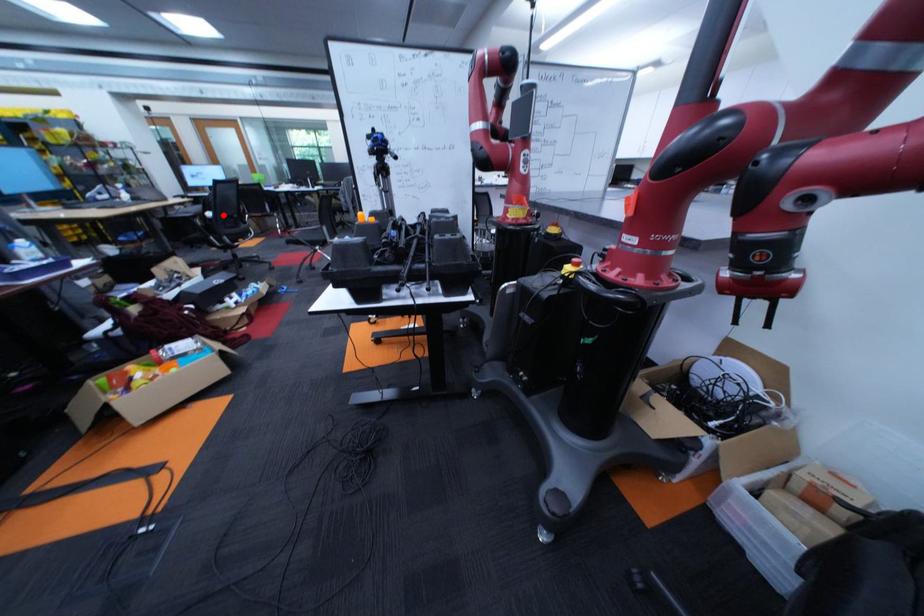
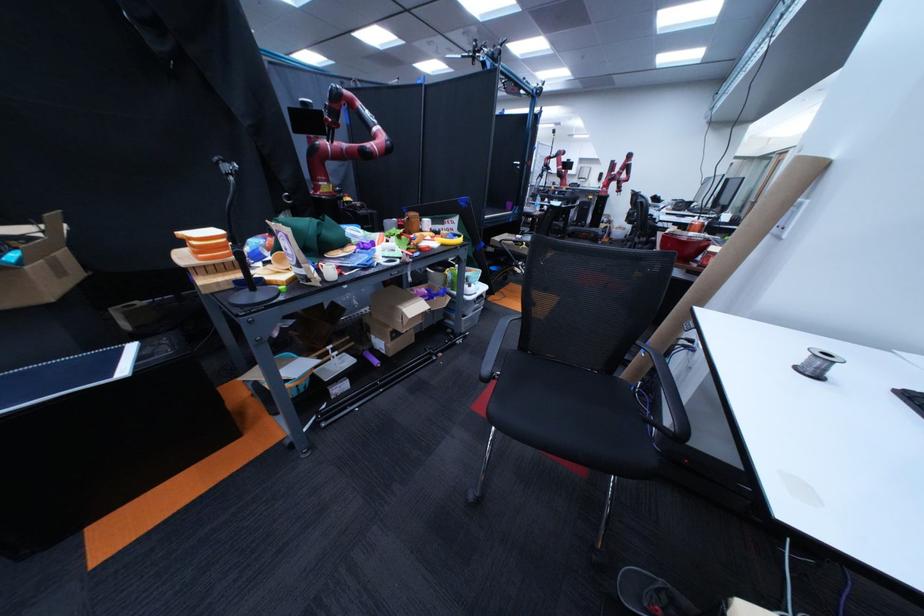
Question: I am providing you with two images of the same scene from different viewpoints. A red point is marked on the first image. At the location where the point appears in image 1, is it still visible in image 2?

Choices:
 (A) Yes
 (B) No

Answer: (B)